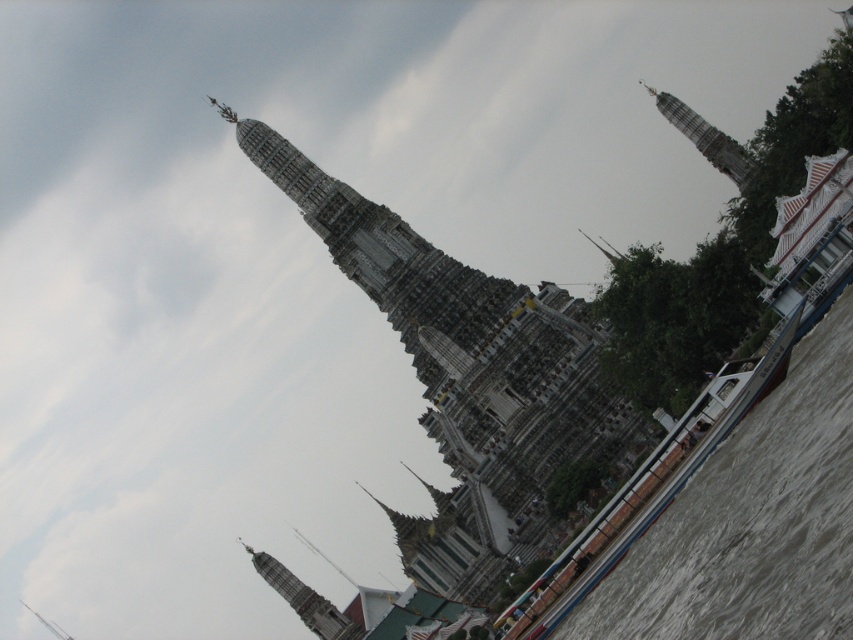
Does smooth stone tower at upper center appear on the right side of gray stone tower at upper right?

Incorrect, smooth stone tower at upper center is not on the right side of gray stone tower at upper right.

Is point (308, 621) farther from camera compared to point (705, 145)?

No.

Where is `smooth stone tower at upper center`? The height and width of the screenshot is (640, 853). smooth stone tower at upper center is located at coordinates (305, 600).

You are a GUI agent. You are given a task and a screenshot of the screen. Output one action in this format:
    pyautogui.click(x=<x>, y=<y>)
    Task: Click on the smooth stone tower at upper center
    Image resolution: width=853 pixels, height=640 pixels.
    Given the screenshot: What is the action you would take?
    pyautogui.click(x=305, y=600)

Is stone temple at center wider than gray stone tower at upper right?

Indeed, stone temple at center has a greater width compared to gray stone tower at upper right.

Is stone temple at center bigger than gray stone tower at upper right?

Correct, stone temple at center is larger in size than gray stone tower at upper right.

Image resolution: width=853 pixels, height=640 pixels. Describe the element at coordinates (468, 369) in the screenshot. I see `stone temple at center` at that location.

Locate an element on the screen. This screenshot has height=640, width=853. stone temple at center is located at coordinates (468, 369).

Is stone temple at center behind smooth stone tower at upper center?

No, stone temple at center is in front of smooth stone tower at upper center.

Between point (460, 576) and point (283, 592), which one is positioned in front?

Point (460, 576) is more forward.

What do you see at coordinates (468, 369) in the screenshot?
I see `stone temple at center` at bounding box center [468, 369].

The image size is (853, 640). What are the coordinates of `stone temple at center` in the screenshot? It's located at click(468, 369).